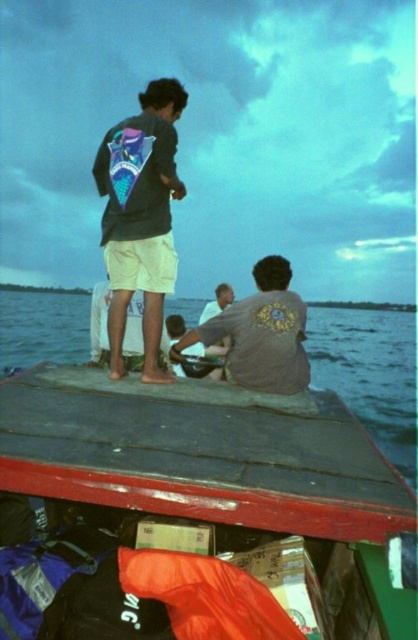
What object is located at the coordinates point (196,513)?

The point (196,513) corresponds to the smooth wooden boat at center.

You are standing on the boat and need to throw a lifebuoy to someone in the water. The lifebuoy is placed at the blue water at center. You see the matte black jacket at upper center on the boat. How far apart are the lifebuoy and the matte black jacket?

The blue water at center and matte black jacket at upper center are 158.23 feet apart.